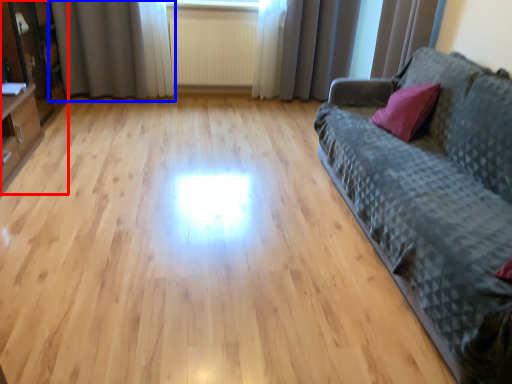
Question: Which point is further to the camera, entertainment center (highlighted by a red box) or curtain (highlighted by a blue box)?

Choices:
 (A) entertainment center
 (B) curtain

Answer: (B)